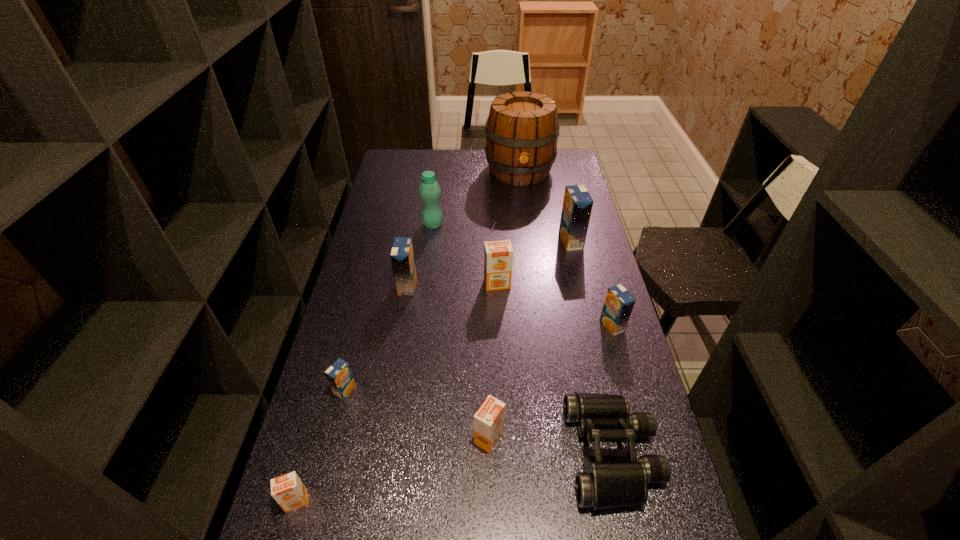
Locate an element on the screen. orange juice object that ranks as the third closest to the sixth farthest orange juice is located at coordinates (618, 305).

Select which blue orange_juice is the fourth closest to the tallest object. Please provide its 2D coordinates. Your answer should be formatted as a tuple, i.e. [(x, y)], where the tuple contains the x and y coordinates of a point satisfying the conditions above.

[(339, 375)]

You are a GUI agent. You are given a task and a screenshot of the screen. Output one action in this format:
    pyautogui.click(x=<x>, y=<y>)
    Task: Click on the blue orange_juice that is the second nearest to the smallest orange orange juice
    
    Given the screenshot: What is the action you would take?
    pyautogui.click(x=402, y=254)

Identify the location of orange orange juice that is the nearest to the leftmost orange orange juice. The height and width of the screenshot is (540, 960). (489, 420).

In order to click on orange orange juice that stands as the third closest to the black binoculars in this screenshot , I will do `click(288, 490)`.

Where is `vacant region that satisfies the following two spatial constraints: 1. on the back side of the smallest blue orange_juice; 2. on the left side of the smallest orange orange juice`? This screenshot has height=540, width=960. vacant region that satisfies the following two spatial constraints: 1. on the back side of the smallest blue orange_juice; 2. on the left side of the smallest orange orange juice is located at coordinates (327, 390).

Locate an element on the screen. free space that satisfies the following two spatial constraints: 1. on the front side of the biggest orange orange juice; 2. on the right side of the fourth nearest orange juice is located at coordinates (499, 326).